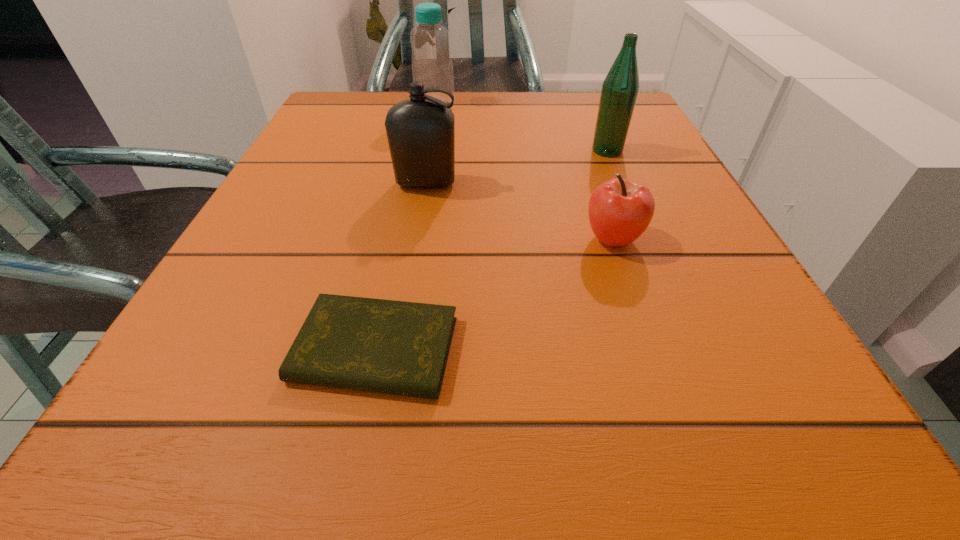
At what (x,y) coordinates should I click in order to perform the action: click on vacant space located 0.200m on the front of the farthest object. Please return your answer as a coordinate pair (x, y). Looking at the image, I should click on click(425, 157).

Identify the location of vacant space located 0.170m on the left of the third tallest object. Image resolution: width=960 pixels, height=540 pixels. (297, 184).

Identify the location of vacant space located on the left of the fourth tallest object. (339, 239).

Where is `free space located on the back of the shortest object`? This screenshot has height=540, width=960. free space located on the back of the shortest object is located at coordinates [x=416, y=158].

Identify the location of object present at the far edge. (432, 65).

Where is `object that is at the near edge`? object that is at the near edge is located at coordinates (395, 347).

Identify the location of object positioned at the left edge. (395, 347).

You are a GUI agent. You are given a task and a screenshot of the screen. Output one action in this format:
    pyautogui.click(x=<x>, y=<y>)
    Task: Click on the bottle present at the right edge
    
    Given the screenshot: What is the action you would take?
    pyautogui.click(x=620, y=88)

This screenshot has width=960, height=540. What are the coordinates of `apple positioned at the right edge` in the screenshot? It's located at (620, 210).

Identify the location of object that is at the near left corner. The height and width of the screenshot is (540, 960). (395, 347).